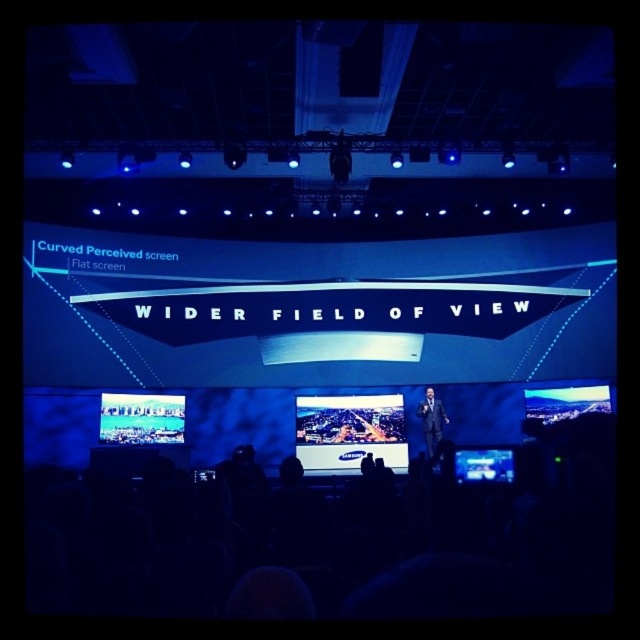
Between matte black screen at lower left and matte black screen at lower right, which one has less height?

With less height is matte black screen at lower right.

Locate an element on the screen. The width and height of the screenshot is (640, 640). matte black screen at lower left is located at coordinates (141, 419).

The width and height of the screenshot is (640, 640). Identify the location of matte black screen at lower left. (141, 419).

Can you confirm if matte black screen at center is wider than matte black screen at lower left?

Yes.

Is point (305, 410) in front of point (128, 410)?

No, (305, 410) is behind (128, 410).

Image resolution: width=640 pixels, height=640 pixels. In order to click on matte black screen at center in this screenshot , I will do `click(349, 432)`.

Image resolution: width=640 pixels, height=640 pixels. I want to click on matte black screen at lower right, so click(x=483, y=465).

Which is more to the right, matte black screen at lower right or dark suit at center?

matte black screen at lower right

Describe the element at coordinates (483, 465) in the screenshot. I see `matte black screen at lower right` at that location.

Locate an element on the screen. The image size is (640, 640). matte black screen at lower right is located at coordinates (483, 465).